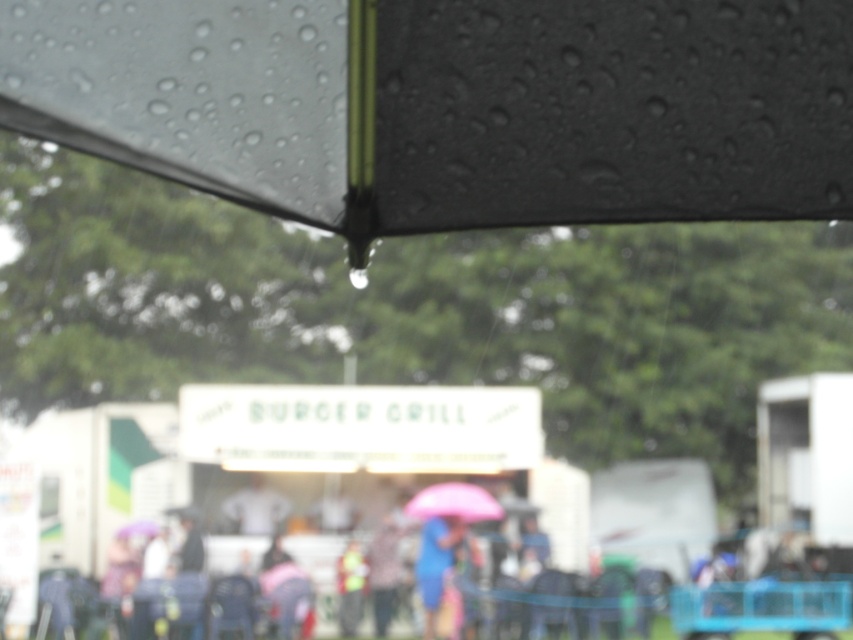
Is blue fabric umbrella at center shorter than pink matte umbrella at center?

No.

Does point (434, 540) come farther from viewer compared to point (448, 488)?

Yes.

What are the coordinates of `blue fabric umbrella at center` in the screenshot? It's located at (434, 563).

Between point (728, 182) and point (422, 554), which one is positioned behind?

Point (422, 554)

Can you confirm if black matte umbrella at upper center is positioned below blue fabric umbrella at center?

Incorrect, black matte umbrella at upper center is not positioned below blue fabric umbrella at center.

Between point (103, 99) and point (436, 576), which one is positioned behind?

The point (436, 576) is behind.

Locate an element on the screen. black matte umbrella at upper center is located at coordinates (451, 106).

Does black matte umbrella at upper center have a greater width compared to pink matte umbrella at center?

No, black matte umbrella at upper center is not wider than pink matte umbrella at center.

Is black matte umbrella at upper center above pink matte umbrella at center?

Indeed, black matte umbrella at upper center is positioned over pink matte umbrella at center.

Which is behind, point (242, 132) or point (467, 490)?

Positioned behind is point (467, 490).

At what (x,y) coordinates should I click in order to perform the action: click on black matte umbrella at upper center. Please return your answer as a coordinate pair (x, y). The image size is (853, 640). Looking at the image, I should click on (451, 106).